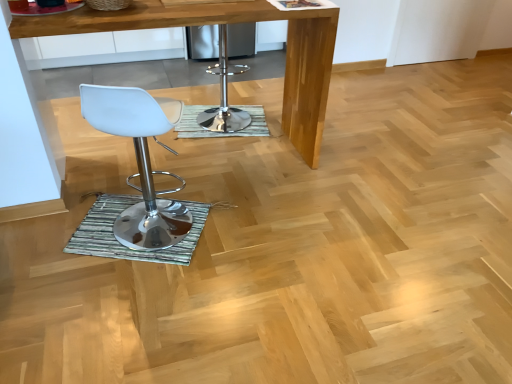
This screenshot has width=512, height=384. Identify the location of vacant region in front of green textured mat at center, the 2th mat positioned from the top. (120, 315).